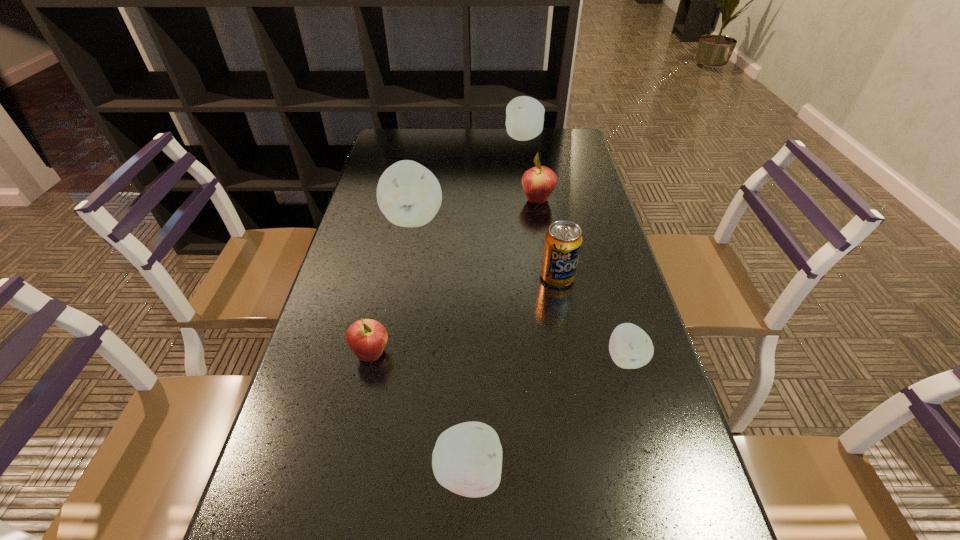
Identify the location of free space between the soda can and the biggest white apple. Image resolution: width=960 pixels, height=540 pixels. (486, 248).

Where is `vacant region between the farthest white apple and the third apple from left to right`? vacant region between the farthest white apple and the third apple from left to right is located at coordinates (496, 306).

Locate an element on the screen. Image resolution: width=960 pixels, height=540 pixels. the second closest object to the biggest white apple is located at coordinates pyautogui.click(x=563, y=241).

In order to click on object that stands as the sixth closest to the third farthest white apple in this screenshot , I will do `click(524, 115)`.

Locate which apple ranks fourth in proximity to the soda can. Please provide its 2D coordinates. Your answer should be formatted as a tuple, i.e. [(x, y)], where the tuple contains the x and y coordinates of a point satisfying the conditions above.

[(366, 338)]

Identify which apple is the fifth closest to the farthest apple. Please provide its 2D coordinates. Your answer should be formatted as a tuple, i.e. [(x, y)], where the tuple contains the x and y coordinates of a point satisfying the conditions above.

[(467, 458)]

I want to click on white apple that is the third closest to the third white apple from right to left, so click(x=524, y=115).

At what (x,y) coordinates should I click in order to perform the action: click on white apple that is the closest to the farther red apple. Please return your answer as a coordinate pair (x, y). Looking at the image, I should click on (409, 195).

Select which red apple is the closest to the fourth apple from right to left. Please provide its 2D coordinates. Your answer should be formatted as a tuple, i.e. [(x, y)], where the tuple contains the x and y coordinates of a point satisfying the conditions above.

[(366, 338)]

Identify the location of vacant area that satisfies the following two spatial constraints: 1. on the front side of the right red apple; 2. on the left side of the fourth nearest object. (550, 277).